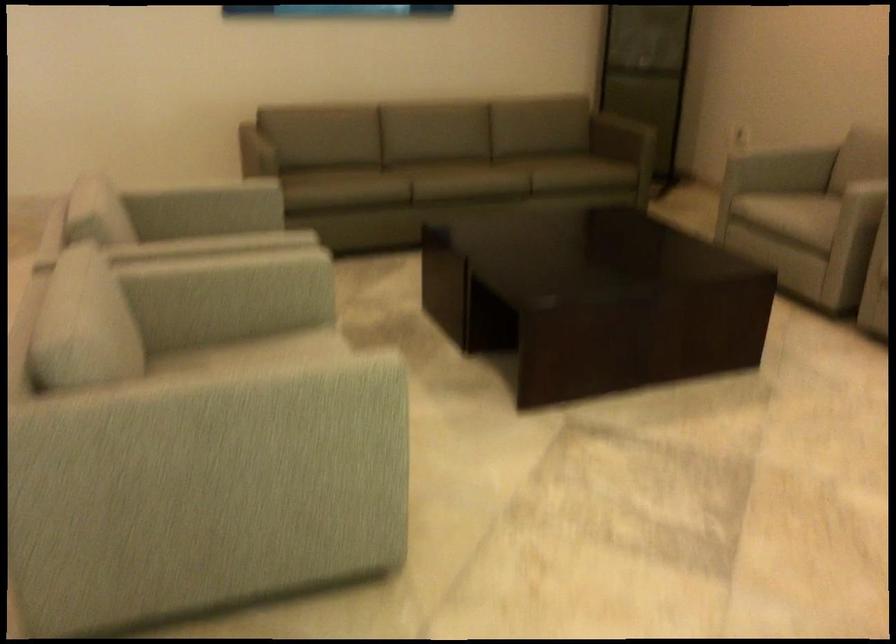
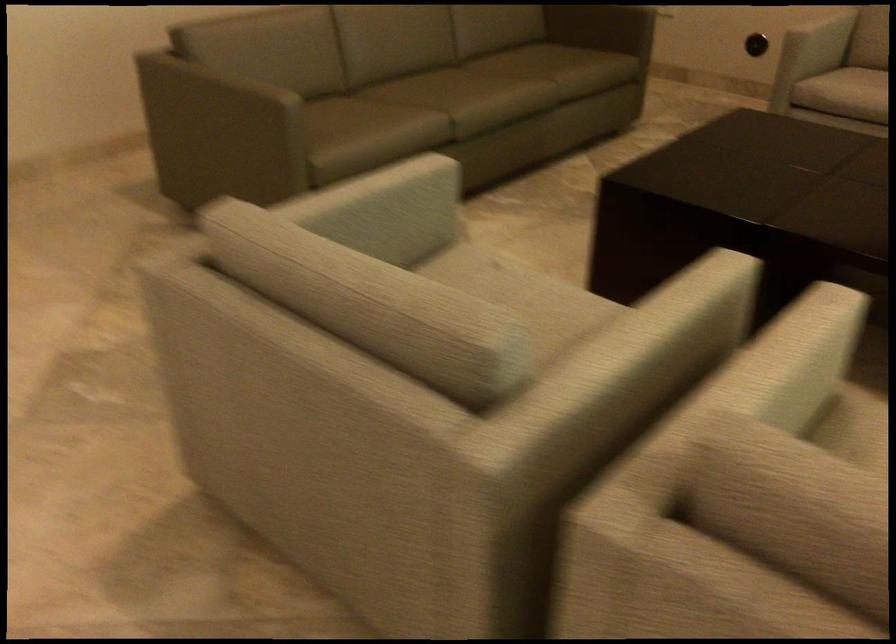
Where in the second image is the point corresponding to (772,164) from the first image?

(821, 35)